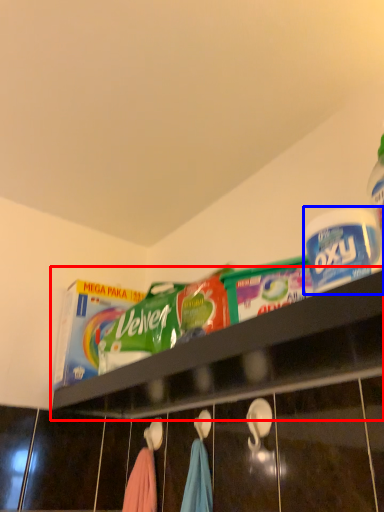
Question: Which object is closer to the camera taking this photo, shelf (highlighted by a red box) or product (highlighted by a blue box)?

Choices:
 (A) shelf
 (B) product

Answer: (A)